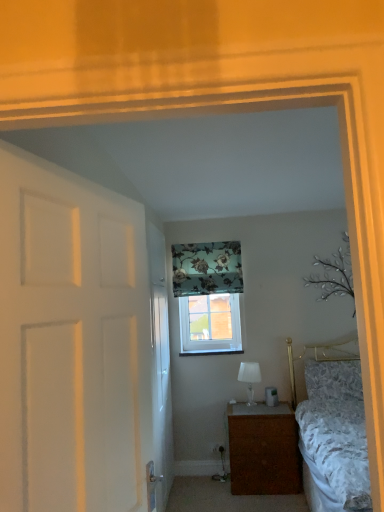
Question: From a real-world perspective, is clear glass window at center physically below brown wood nightstand at lower center?

Choices:
 (A) no
 (B) yes

Answer: (A)

Question: Does clear glass window at center have a smaller size compared to brown wood nightstand at lower center?

Choices:
 (A) yes
 (B) no

Answer: (A)

Question: Are clear glass window at center and brown wood nightstand at lower center far apart?

Choices:
 (A) no
 (B) yes

Answer: (A)

Question: From a real-world perspective, is clear glass window at center on top of brown wood nightstand at lower center?

Choices:
 (A) yes
 (B) no

Answer: (A)

Question: Is the depth of clear glass window at center greater than that of brown wood nightstand at lower center?

Choices:
 (A) no
 (B) yes

Answer: (B)

Question: Considering the relative sizes of clear glass window at center and brown wood nightstand at lower center in the image provided, is clear glass window at center taller than brown wood nightstand at lower center?

Choices:
 (A) no
 (B) yes

Answer: (A)

Question: Does clear glass window at center have a lesser height compared to white matte door at left, the first door viewed from the front?

Choices:
 (A) no
 (B) yes

Answer: (B)

Question: Does clear glass window at center have a larger size compared to white matte door at left, the first door viewed from the front?

Choices:
 (A) no
 (B) yes

Answer: (A)

Question: From the image's perspective, is clear glass window at center located above white matte door at left, which is counted as the second door, starting from the back?

Choices:
 (A) yes
 (B) no

Answer: (B)

Question: Is clear glass window at center at the right side of white matte door at left, the first door viewed from the front?

Choices:
 (A) yes
 (B) no

Answer: (A)

Question: Is clear glass window at center positioned before white matte door at left, which is counted as the second door, starting from the back?

Choices:
 (A) no
 (B) yes

Answer: (A)

Question: Considering the relative sizes of clear glass window at center and white matte door at left, the first door viewed from the front, in the image provided, is clear glass window at center taller than white matte door at left, the first door viewed from the front,?

Choices:
 (A) yes
 (B) no

Answer: (B)

Question: From the image's perspective, would you say clear glass window at center is positioned over white glossy table lamp at center?

Choices:
 (A) yes
 (B) no

Answer: (A)